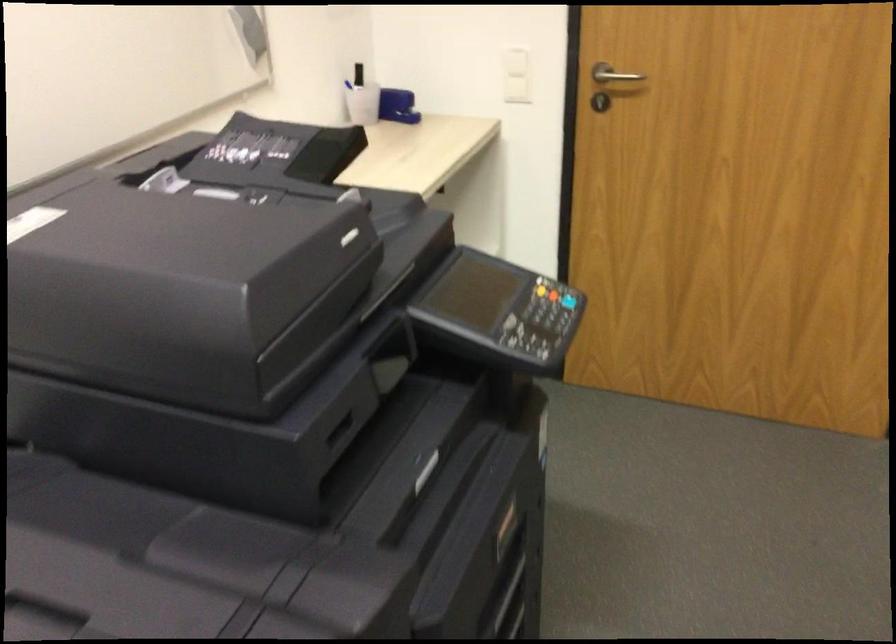
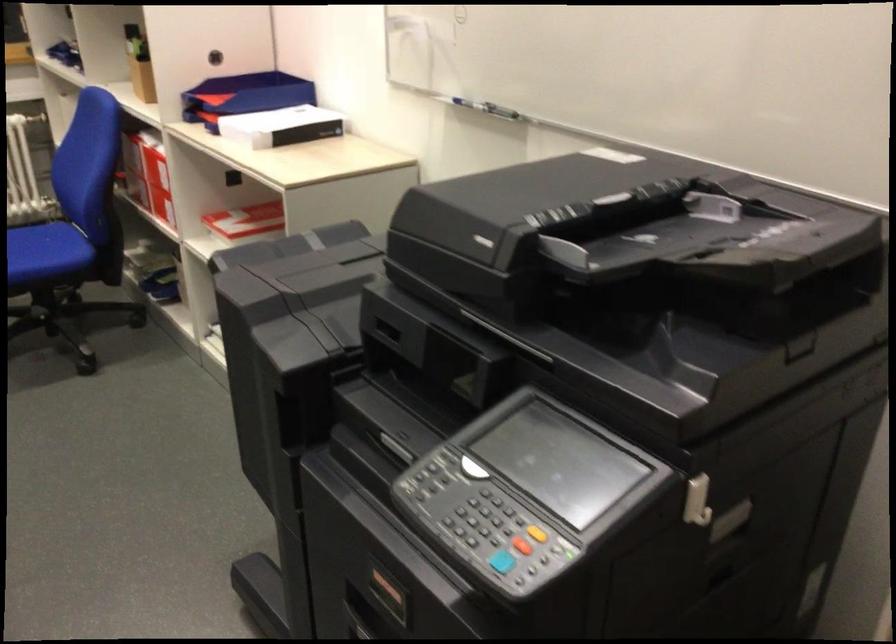
In the second image, find the point that corresponds to point 548,328 in the first image.

(521, 545)